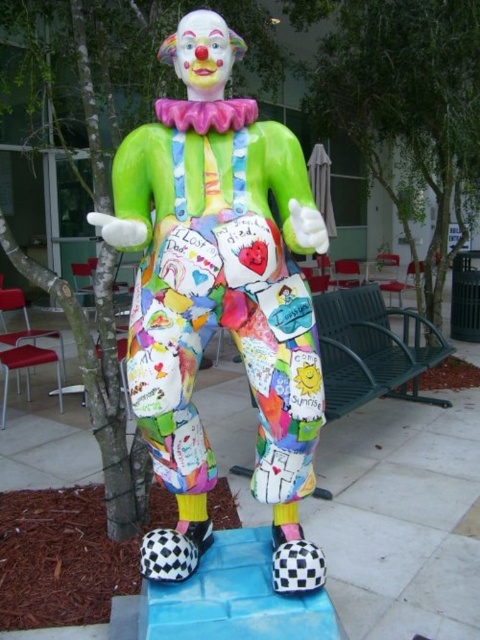
Who is positioned more to the left, matte plastic clown at center or green leafy tree at center?

matte plastic clown at center

Who is higher up, matte plastic clown at center or green leafy tree at center?

Positioned higher is green leafy tree at center.

Between point (276, 180) and point (398, 211), which one is positioned behind?

The point (398, 211) is more distant.

This screenshot has height=640, width=480. I want to click on matte plastic clown at center, so click(x=220, y=288).